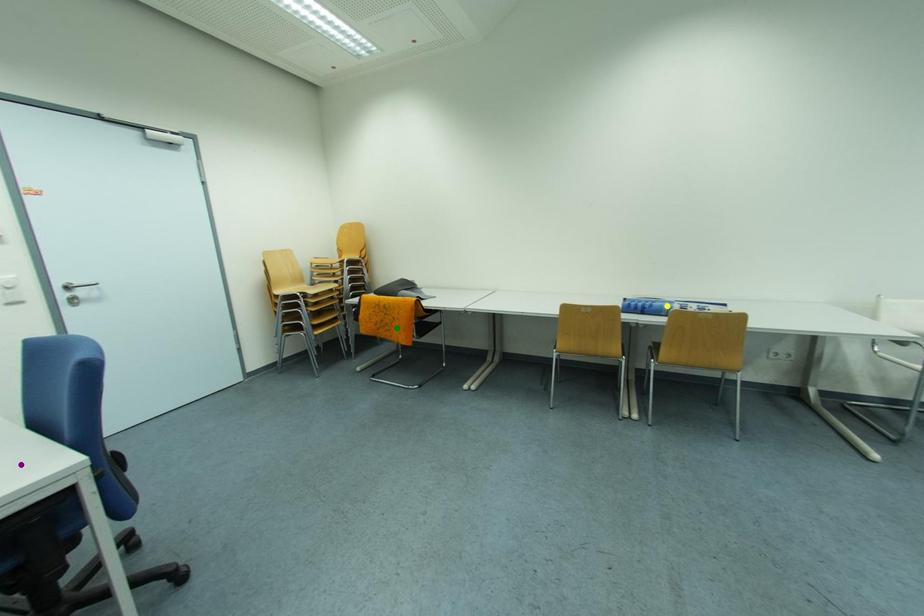
Order these from nearest to farthest:
yellow point | green point | purple point

green point < yellow point < purple point